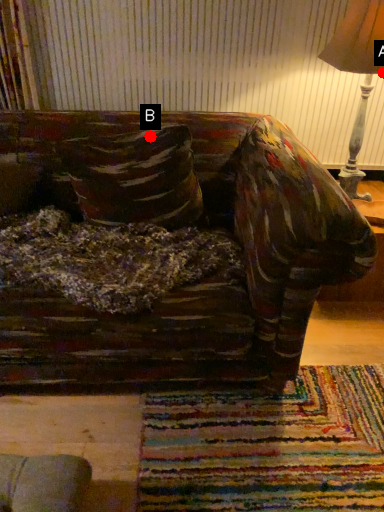
Question: Two points are circled on the image, labeled by A and B beside each circle. Which point appears closest to the camera in this image?

Choices:
 (A) A is closer
 (B) B is closer

Answer: (A)